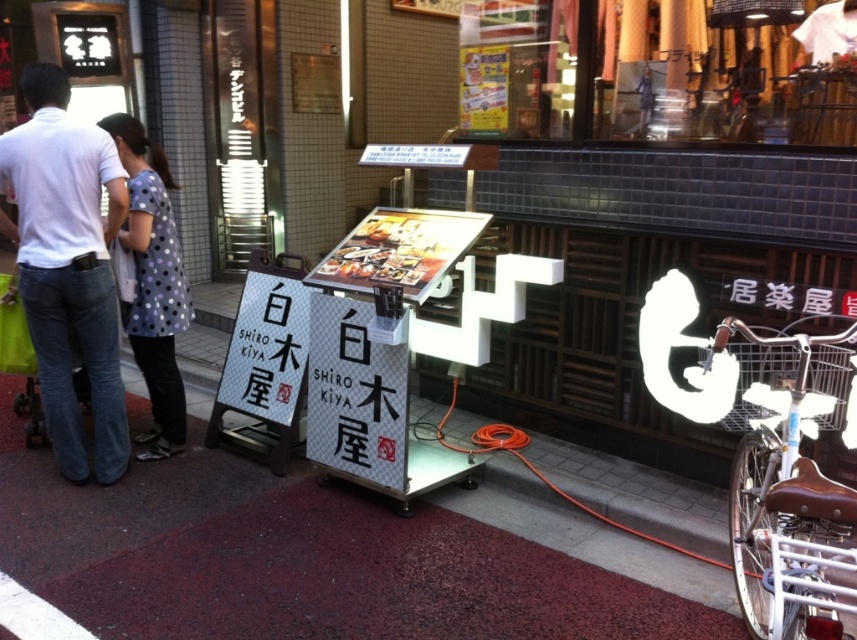
You are a delivery person who needs to place a package on the maroon carpet at center and the white paper sign at center. Which object should you place the package on first if you want to reach both from the left side of the scene?

You should place the package on the maroon carpet at center first because it is to the left of the white paper sign at center, so you can reach it first when approaching from the left side of the scene.